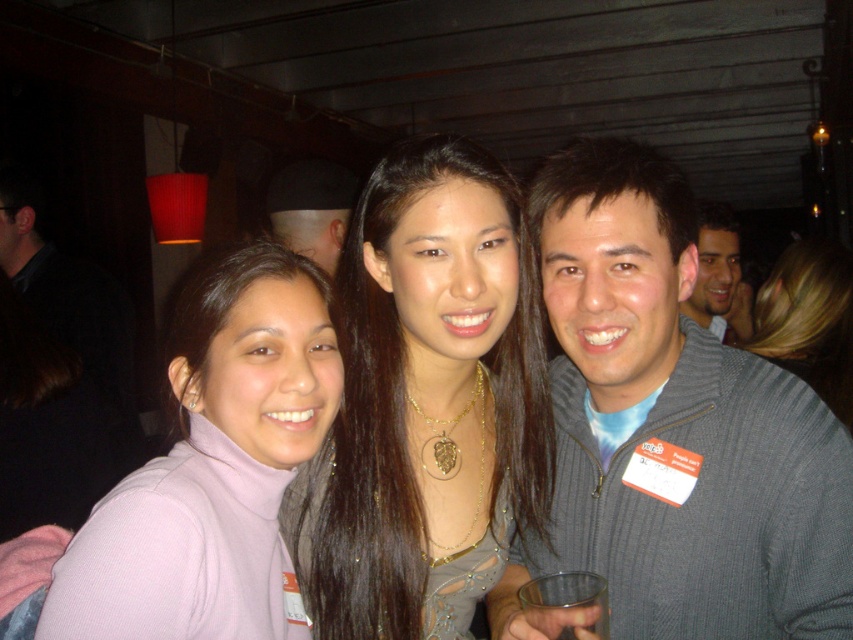
Question: Estimate the real-world distances between objects in this image. Which object is closer to the shiny black hat at upper center?

Choices:
 (A) shiny gold necklace at center
 (B) gray ribbed sweater at center
 (C) matte gray sweater at upper right
 (D) pink turtleneck sweater at center

Answer: (C)

Question: Considering the relative positions of gray ribbed sweater at center and shiny black hat at upper center in the image provided, where is gray ribbed sweater at center located with respect to shiny black hat at upper center?

Choices:
 (A) right
 (B) left

Answer: (A)

Question: Does matte gold necklace at center have a larger size compared to shiny gold necklace at center?

Choices:
 (A) yes
 (B) no

Answer: (B)

Question: Which object is positioned farthest from the gray ribbed sweater at center?

Choices:
 (A) transparent glass cup at lower center
 (B) matte gray sweater at upper right
 (C) shiny black hat at upper center
 (D) matte gold necklace at center

Answer: (C)

Question: Is gray ribbed sweater at center positioned in front of matte gray sweater at upper right?

Choices:
 (A) no
 (B) yes

Answer: (B)

Question: Based on their relative distances, which object is nearer to the gray ribbed sweater at center?

Choices:
 (A) pink turtleneck sweater at center
 (B) shiny gold necklace at center
 (C) transparent glass cup at lower center
 (D) matte gold necklace at center

Answer: (D)